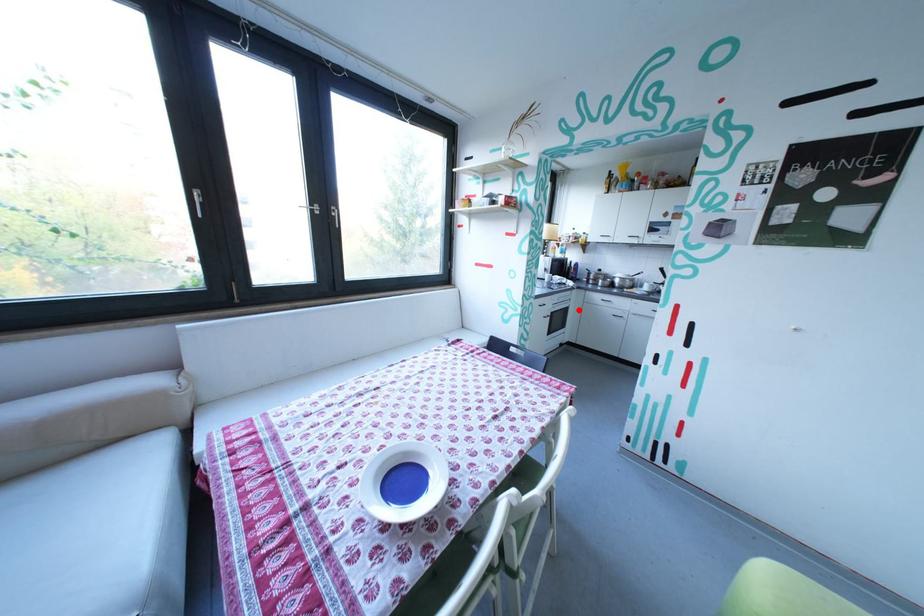
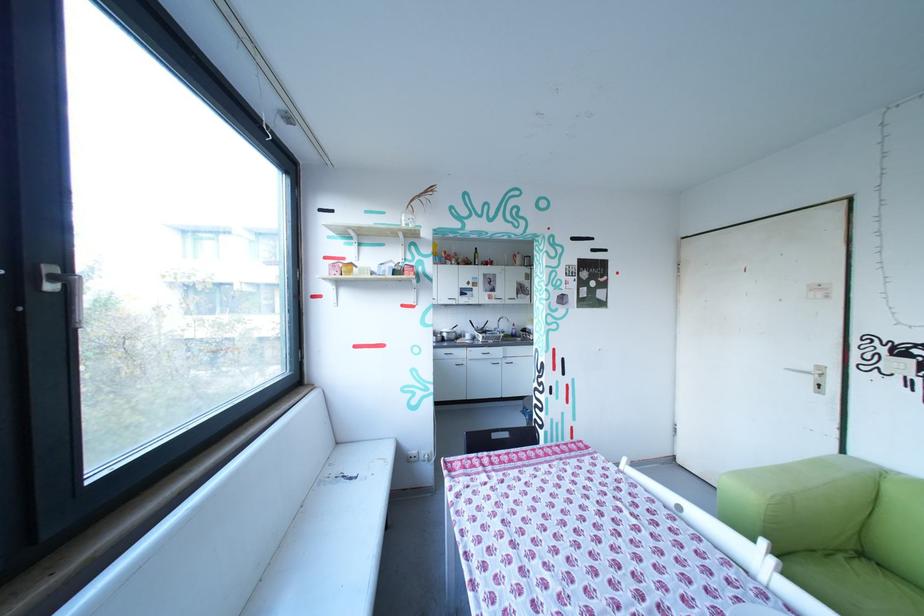
Question: I am providing you with two images of the same scene from different viewpoints. A red point is marked on the first image. At the location where the point appears in image 1, is it still visible in image 2?

Choices:
 (A) Yes
 (B) No

Answer: (B)